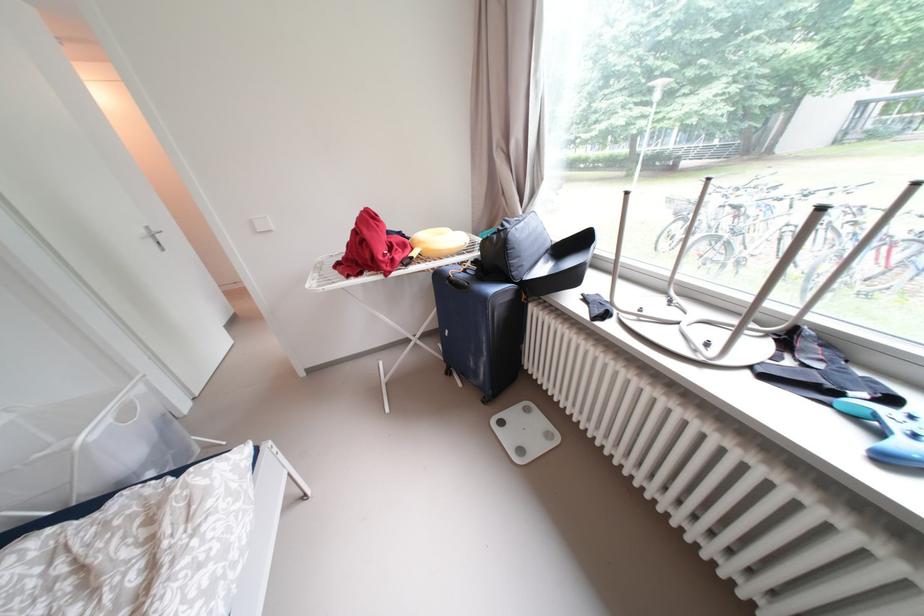
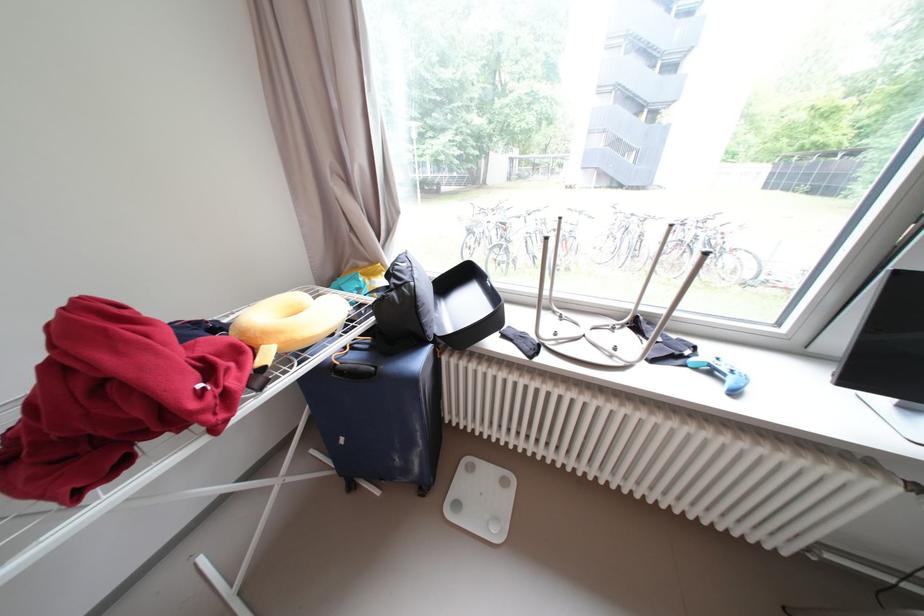
Locate, in the second image, the point that corresponds to point 532,431 in the first image.

(490, 495)